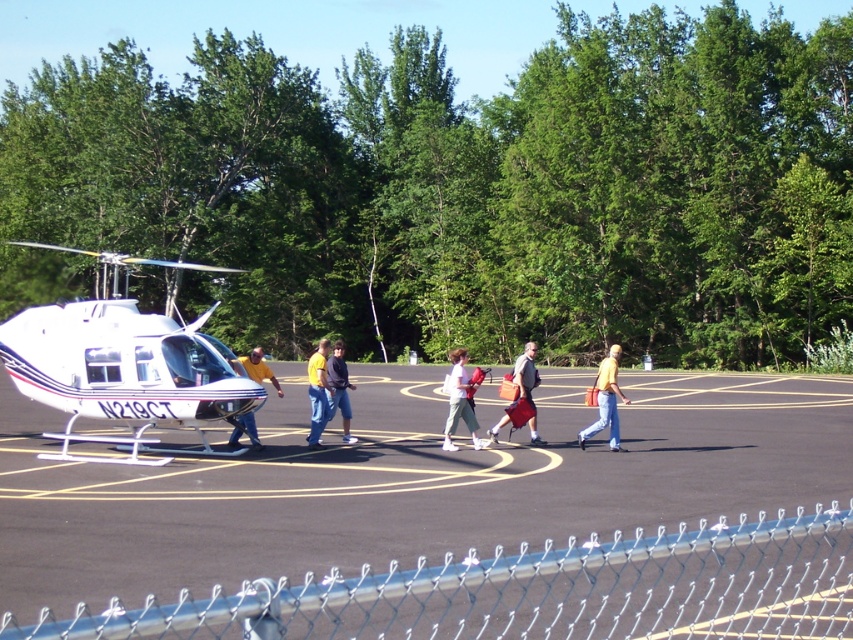
Is the position of white cotton shirt at center more distant than that of yellow fabric shirt at center?

No, it is in front of yellow fabric shirt at center.

Is point (447, 422) positioned in front of point (326, 381)?

Yes, it is in front of point (326, 381).

What do you see at coordinates (459, 401) in the screenshot? The image size is (853, 640). I see `white cotton shirt at center` at bounding box center [459, 401].

Find the location of a particular element. The width and height of the screenshot is (853, 640). white cotton shirt at center is located at coordinates (459, 401).

Who is shorter, metal chain-link fence at lower center or yellow fabric shirt at center?

Standing shorter between the two is metal chain-link fence at lower center.

This screenshot has width=853, height=640. Identify the location of metal chain-link fence at lower center. (535, 592).

At what (x,y) coordinates should I click in order to perform the action: click on metal chain-link fence at lower center. Please return your answer as a coordinate pair (x, y). Looking at the image, I should click on (535, 592).

Can you confirm if white cotton shirt at center is bigger than dark blue jeans at center?

Actually, white cotton shirt at center might be smaller than dark blue jeans at center.

Does point (448, 372) come behind point (347, 381)?

Yes, point (448, 372) is farther from viewer.

Locate an element on the screen. The image size is (853, 640). white cotton shirt at center is located at coordinates (459, 401).